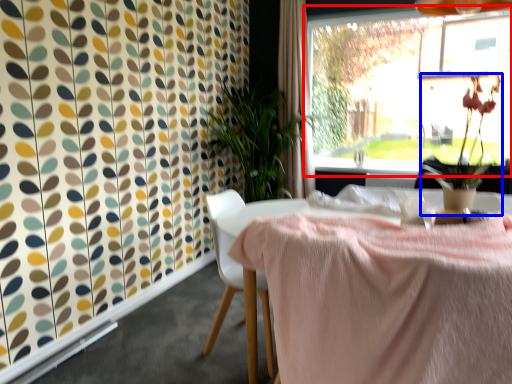
Question: Which object is closer to the camera taking this photo, window (highlighted by a red box) or floral arrangement (highlighted by a blue box)?

Choices:
 (A) window
 (B) floral arrangement

Answer: (B)